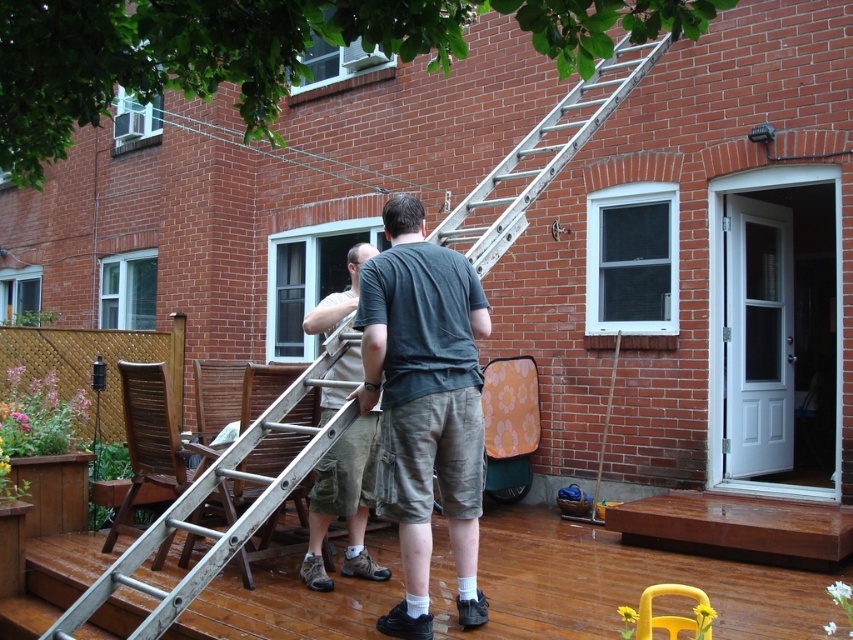
You are a delivery person trying to place a large package on the wooden deck. The package is too heavy to lift, so you need to slide it from the driveway onto the deck. The wooden deck has two objects in your way. One is the wooden at lower left and the other is the silver metallic ladder at center. Which object must you move first to clear the path for sliding the package onto the deck?

The wooden at lower left must be moved first because it is positioned under the silver metallic ladder at center, so removing it first would allow the ladder to be adjusted or moved afterward to fully clear the path.

You are a maintenance worker who needs to reach a tool placed between the silver metallic ladder at center and the khaki cotton shorts at center. If your reach is 1.5 meters, can you grab the tool without moving either object?

A: The silver metallic ladder at center and khaki cotton shorts at center are 2.26 meters apart. Since your reach is only 1.5 meters, you cannot grab the tool without moving either object.